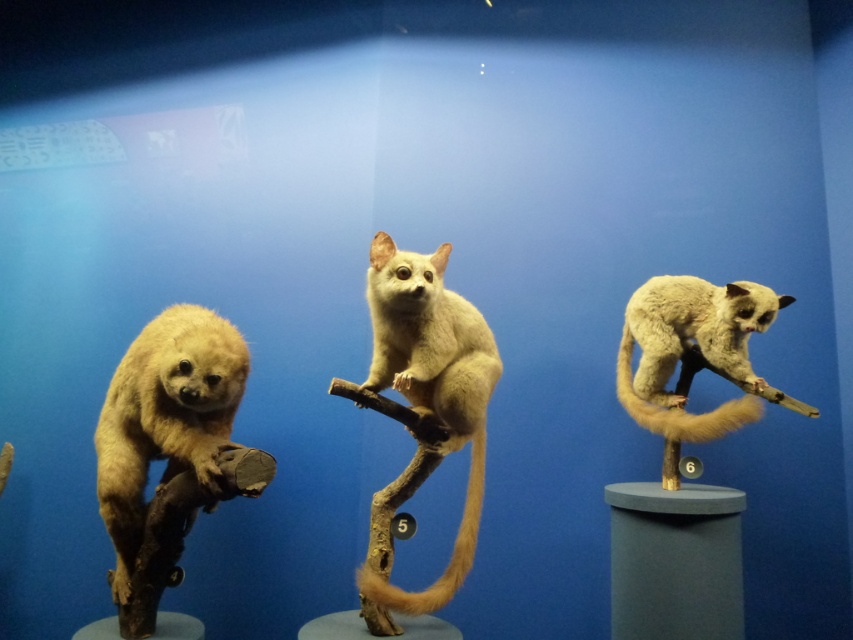
Question: Does light brown fur at left have a larger size compared to golden fur tail at center?

Choices:
 (A) no
 (B) yes

Answer: (B)

Question: Which of the following is the farthest from the observer?

Choices:
 (A) golden fur tail at center
 (B) fuzzy white tail at right
 (C) fuzzy beige animal at center
 (D) light brown fur at left

Answer: (B)

Question: Which point is closer to the camera taking this photo?

Choices:
 (A) (381, 360)
 (B) (131, 460)
 (C) (735, 412)
 (D) (468, 570)

Answer: (D)

Question: Is light brown fur at left positioned in front of golden fur tail at center?

Choices:
 (A) yes
 (B) no

Answer: (A)

Question: Can you confirm if light brown fur at left is positioned below fuzzy white tail at right?

Choices:
 (A) no
 (B) yes

Answer: (B)

Question: Which of the following is the closest to the observer?

Choices:
 (A) (236, 369)
 (B) (473, 458)
 (C) (428, 593)
 (D) (676, 408)

Answer: (A)